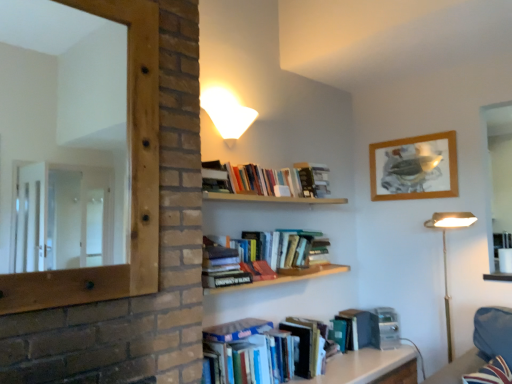
Question: Can you confirm if gold metallic floor lamp at right is smaller than hardcover books at upper center, which ranks as the first book in top-to-bottom order?

Choices:
 (A) no
 (B) yes

Answer: (A)

Question: Is gold metallic floor lamp at right at the left side of hardcover books at upper center, which ranks as the first book in top-to-bottom order?

Choices:
 (A) yes
 (B) no

Answer: (B)

Question: From a real-world perspective, is gold metallic floor lamp at right located beneath hardcover books at upper center, the 2th book when ordered from bottom to top?

Choices:
 (A) yes
 (B) no

Answer: (A)

Question: Is gold metallic floor lamp at right closer to the viewer compared to hardcover books at upper center, which ranks as the first book in top-to-bottom order?

Choices:
 (A) no
 (B) yes

Answer: (A)

Question: Is hardcover books at upper center, the 2th book when ordered from bottom to top, at the back of gold metallic floor lamp at right?

Choices:
 (A) yes
 (B) no

Answer: (B)

Question: From a real-world perspective, is hardcover books at lower center, which is the 1th book in bottom-to-top order, above or below wooden table at lower center?

Choices:
 (A) below
 (B) above

Answer: (B)

Question: Does point tap(271, 365) appear closer or farther from the camera than point tap(375, 370)?

Choices:
 (A) farther
 (B) closer

Answer: (B)

Question: In terms of size, does hardcover books at lower center, which is the 1th book in bottom-to-top order, appear bigger or smaller than wooden table at lower center?

Choices:
 (A) big
 (B) small

Answer: (A)

Question: Is hardcover books at lower center, which is the 1th book in bottom-to-top order, in front of or behind wooden table at lower center in the image?

Choices:
 (A) front
 (B) behind

Answer: (A)

Question: Relative to hardcover book at upper center, which is the second paperback book from right to left, is green matte paperback book at lower center, arranged as the 1th paperback book when ordered from the bottom, in front or behind?

Choices:
 (A) front
 (B) behind

Answer: (B)

Question: Is point (376, 322) positioned closer to the camera than point (311, 165)?

Choices:
 (A) closer
 (B) farther

Answer: (B)

Question: Is green matte paperback book at lower center, positioned as the second paperback book in left-to-right order, taller or shorter than hardcover book at upper center, the second paperback book in the bottom-to-top sequence?

Choices:
 (A) tall
 (B) short

Answer: (B)

Question: From a real-world perspective, relative to hardcover book at upper center, which is the second paperback book from right to left, is green matte paperback book at lower center, arranged as the 1th paperback book when ordered from the bottom, vertically above or below?

Choices:
 (A) below
 (B) above

Answer: (A)

Question: Considering the positions of point (233, 187) and point (306, 173), is point (233, 187) closer or farther from the camera than point (306, 173)?

Choices:
 (A) closer
 (B) farther

Answer: (A)

Question: From a real-world perspective, is hardcover books at upper center, the 2th book when ordered from bottom to top, physically located above or below hardcover book at upper center, arranged as the first paperback book when viewed from the top?

Choices:
 (A) below
 (B) above

Answer: (A)